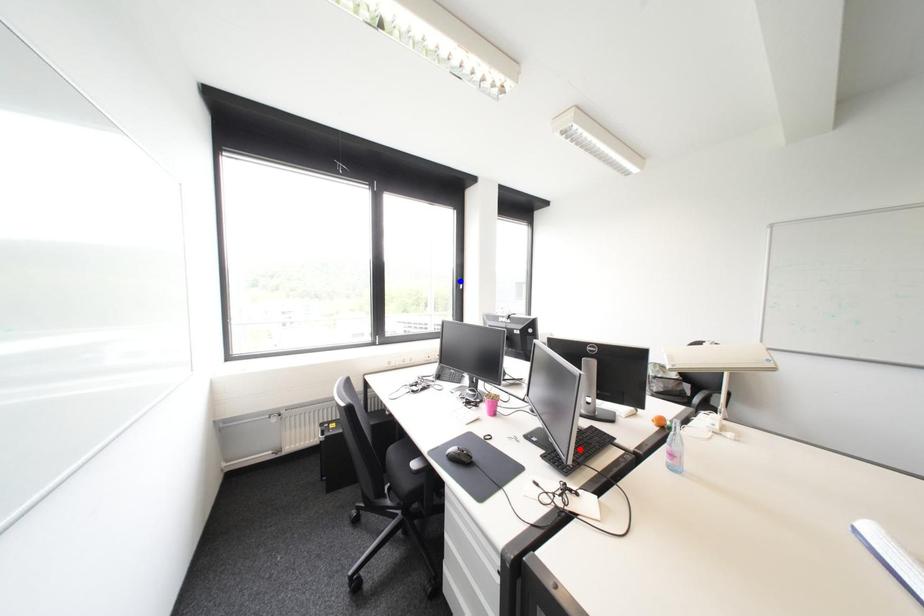
Question: Which of the two points in the image is closer to the camera?

Choices:
 (A) Blue point is closer.
 (B) Red point is closer.

Answer: (B)